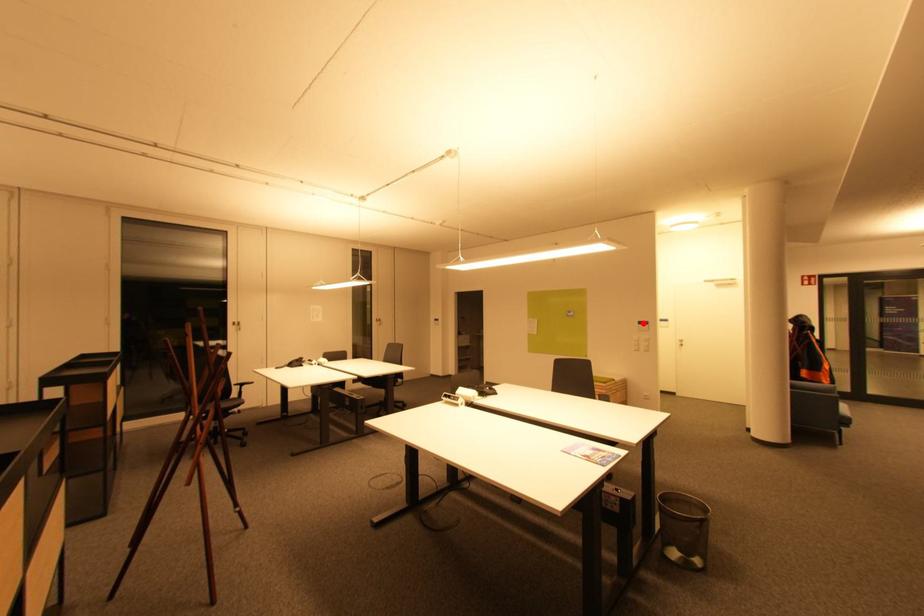
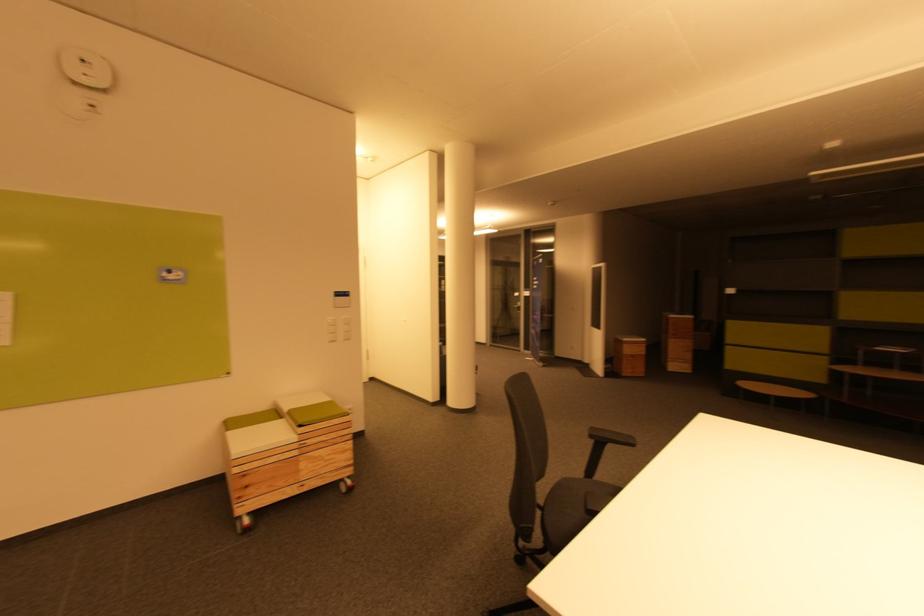
Where in the second image is the point corresponding to the highlighted location from the first image?

(342, 294)